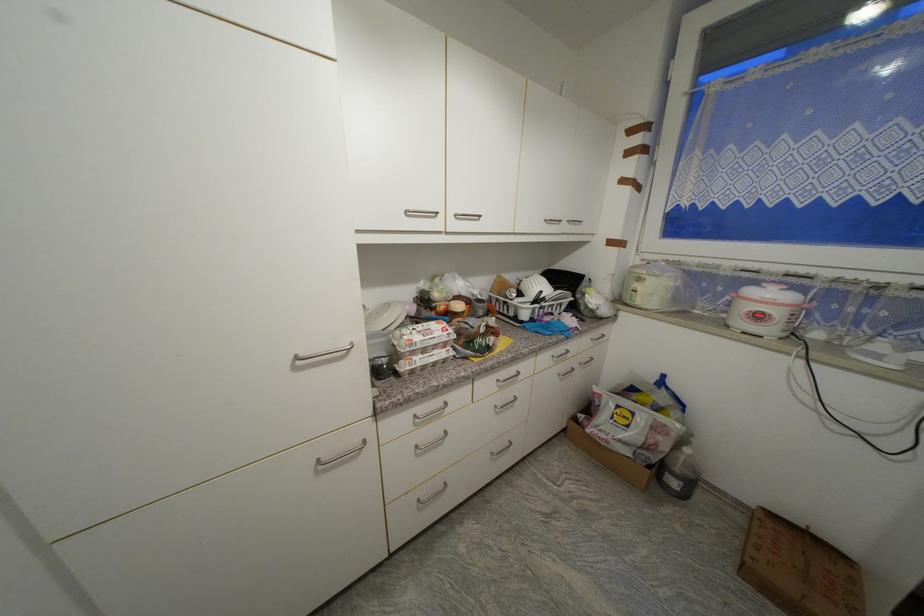
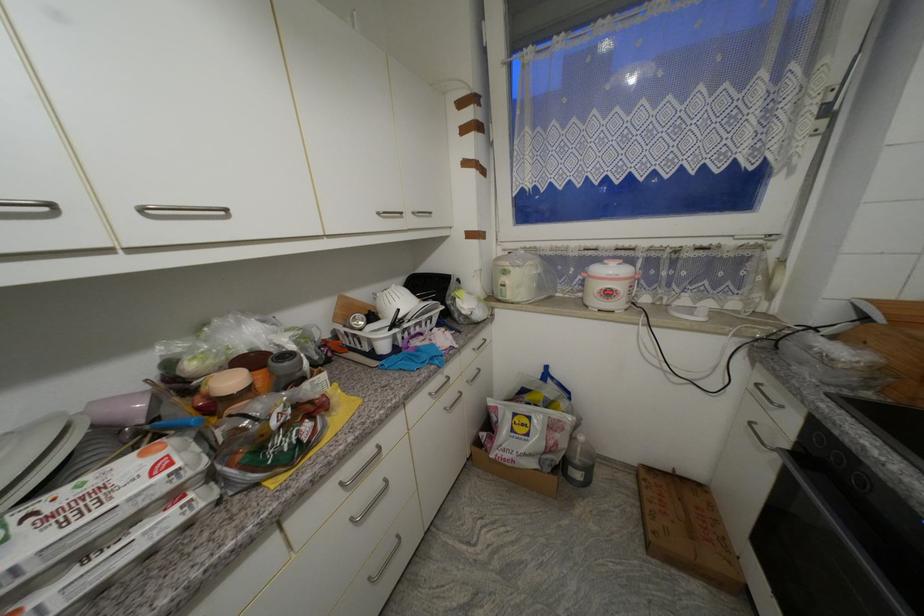
Find the pixel in the second image that matches pixel 645 281 in the first image.

(511, 274)